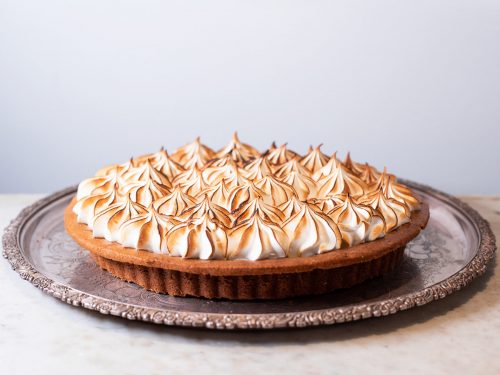
Locate an element on the screen. The width and height of the screenshot is (500, 375). marble is located at coordinates (425, 333).